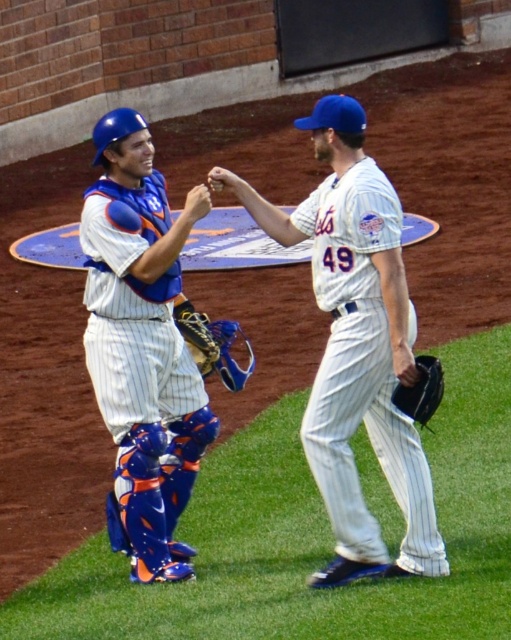
Does white pinstriped uniform at center appear under black leather baseball glove at right?

Actually, white pinstriped uniform at center is above black leather baseball glove at right.

Is point (358, 564) closer to viewer compared to point (431, 412)?

No, it is not.

Where is `white pinstriped uniform at center`? The width and height of the screenshot is (511, 640). white pinstriped uniform at center is located at coordinates (357, 346).

Where is `white pinstriped uniform at center`? This screenshot has width=511, height=640. white pinstriped uniform at center is located at coordinates (357, 346).

Can you confirm if black leather baseball glove at right is positioned to the left of leather textured glove at center?

No, black leather baseball glove at right is not to the left of leather textured glove at center.

Which is behind, point (440, 371) or point (202, 323)?

Point (202, 323)

This screenshot has width=511, height=640. In order to click on black leather baseball glove at right in this screenshot , I will do `click(421, 390)`.

Between white pinstriped uniform at center and white pinstriped uniform at left, which one has less height?

Standing shorter between the two is white pinstriped uniform at left.

Is point (327, 280) closer to viewer compared to point (87, 189)?

Yes, point (327, 280) is in front of point (87, 189).

The width and height of the screenshot is (511, 640). I want to click on white pinstriped uniform at center, so click(357, 346).

This screenshot has height=640, width=511. I want to click on white pinstriped uniform at center, so click(x=357, y=346).